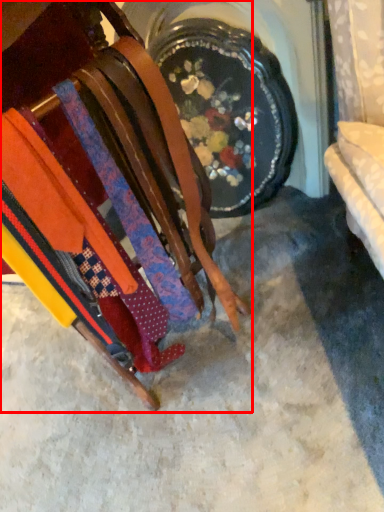
Question: Considering the relative positions of furniture (annotated by the red box) and concrete in the image provided, where is furniture (annotated by the red box) located with respect to the staircase?

Choices:
 (A) left
 (B) right

Answer: (A)